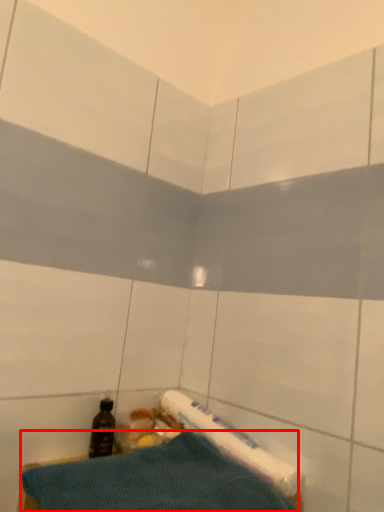
Question: From the image's perspective, considering the relative positions of sheet (annotated by the red box) and bottle in the image provided, where is sheet (annotated by the red box) located with respect to the staircase?

Choices:
 (A) above
 (B) below

Answer: (B)